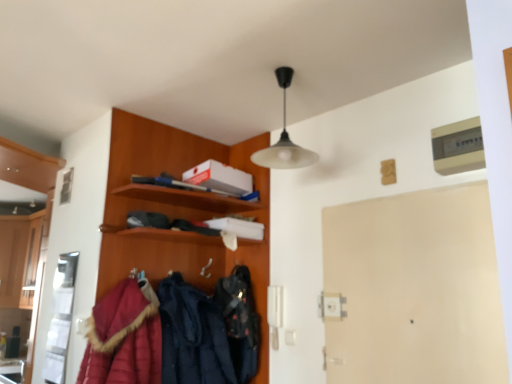
Question: Is wooden coat rack at upper left beside velvet black bag at center, positioned as the first clothing in right-to-left order?

Choices:
 (A) yes
 (B) no

Answer: (B)

Question: Is the depth of wooden coat rack at upper left greater than that of velvet black bag at center, acting as the 2th clothing starting from the left?

Choices:
 (A) yes
 (B) no

Answer: (B)

Question: Is wooden coat rack at upper left taller than velvet black bag at center, positioned as the first clothing in right-to-left order?

Choices:
 (A) no
 (B) yes

Answer: (B)

Question: Can you confirm if wooden coat rack at upper left is bigger than velvet black bag at center, acting as the 2th clothing starting from the left?

Choices:
 (A) yes
 (B) no

Answer: (A)

Question: Considering the relative sizes of wooden coat rack at upper left and velvet black bag at center, positioned as the first clothing in right-to-left order, in the image provided, is wooden coat rack at upper left wider than velvet black bag at center, positioned as the first clothing in right-to-left order,?

Choices:
 (A) no
 (B) yes

Answer: (B)

Question: Is quilted red coat at lower left in front of or behind beige matte door at center in the image?

Choices:
 (A) front
 (B) behind

Answer: (B)

Question: Visually, is quilted red coat at lower left positioned to the left or to the right of beige matte door at center?

Choices:
 (A) left
 (B) right

Answer: (A)

Question: Considering the positions of quilted red coat at lower left and beige matte door at center in the image, is quilted red coat at lower left taller or shorter than beige matte door at center?

Choices:
 (A) short
 (B) tall

Answer: (A)

Question: Is quilted red coat at lower left wider or thinner than beige matte door at center?

Choices:
 (A) wide
 (B) thin

Answer: (A)

Question: Do you think velvet-like navy blue coat at center, marked as the 2th clothing in a right-to-left arrangement, is within wooden coat rack at upper left, or outside of it?

Choices:
 (A) inside
 (B) outside

Answer: (A)

Question: In terms of size, does velvet-like navy blue coat at center, which ranks as the 1th clothing in left-to-right order, appear bigger or smaller than wooden coat rack at upper left?

Choices:
 (A) small
 (B) big

Answer: (A)

Question: Is point (212, 331) closer or farther from the camera than point (264, 261)?

Choices:
 (A) farther
 (B) closer

Answer: (B)

Question: Is velvet-like navy blue coat at center, which ranks as the 1th clothing in left-to-right order, taller or shorter than wooden coat rack at upper left?

Choices:
 (A) tall
 (B) short

Answer: (B)

Question: Would you say matte black pendant light at upper center is to the left or to the right of velvet black bag at center, positioned as the first clothing in right-to-left order, in the picture?

Choices:
 (A) left
 (B) right

Answer: (B)

Question: Looking at their shapes, would you say matte black pendant light at upper center is wider or thinner than velvet black bag at center, positioned as the first clothing in right-to-left order?

Choices:
 (A) wide
 (B) thin

Answer: (A)